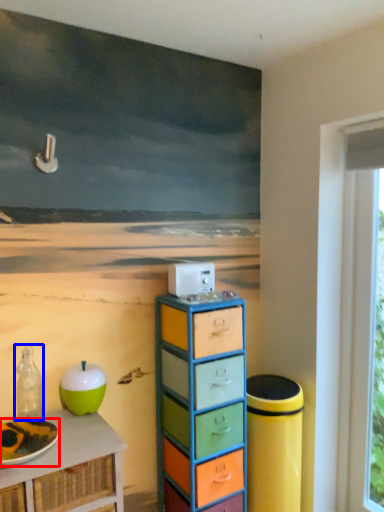
Question: Which of the following is the farthest to the observer, plate (highlighted by a red box) or bottle (highlighted by a blue box)?

Choices:
 (A) plate
 (B) bottle

Answer: (B)